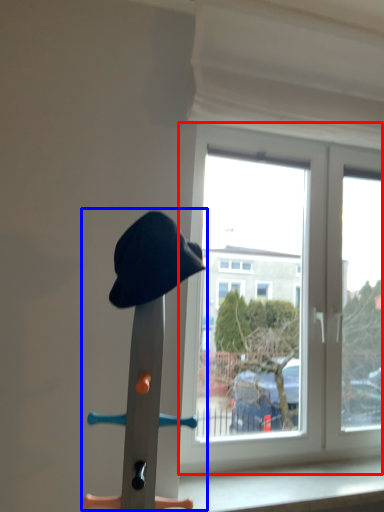
Question: Which object appears closest to the camera in this image, window (highlighted by a red box) or sculpture (highlighted by a blue box)?

Choices:
 (A) window
 (B) sculpture

Answer: (B)